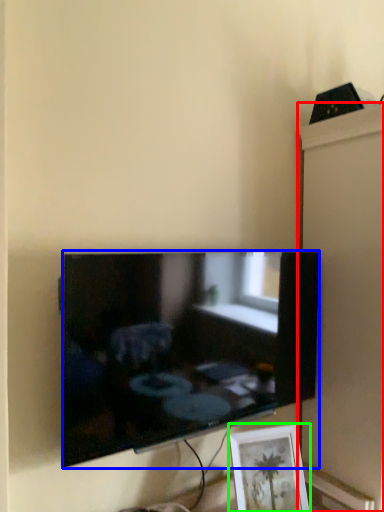
Question: Estimate the real-world distances between objects in this image. Which object is closer to cabinet (highlighted by a red box), television (highlighted by a blue box) or picture frame (highlighted by a green box)?

Choices:
 (A) television
 (B) picture frame

Answer: (A)